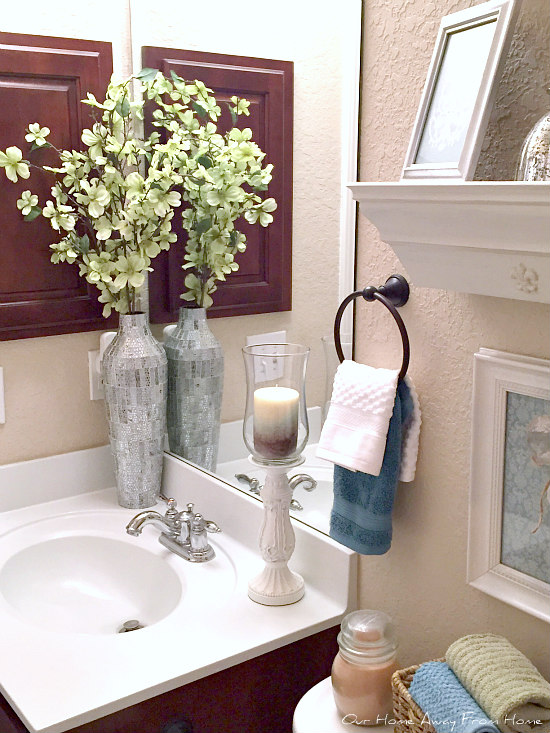
I want to click on faucet, so click(137, 525).